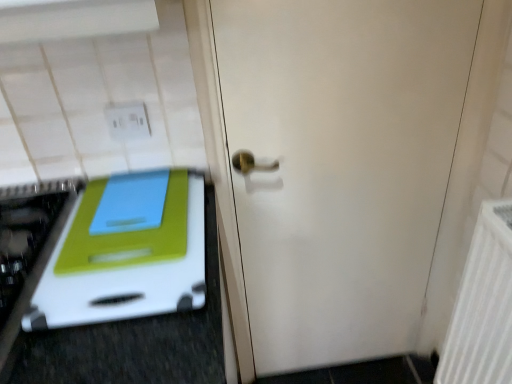
Question: From a real-world perspective, is white matte door at center physically located above or below white plastic cutting board at left?

Choices:
 (A) above
 (B) below

Answer: (B)

Question: Which is correct: white matte door at center is inside white plastic cutting board at left, or outside of it?

Choices:
 (A) outside
 (B) inside

Answer: (A)

Question: Estimate the real-world distances between objects in this image. Which object is farther from the white matte door at center?

Choices:
 (A) white plastic cutting board at left
 (B) white textured radiator at right
 (C) white plastic electric outlet at upper left

Answer: (C)

Question: Considering the real-world distances, which object is farthest from the white textured radiator at right?

Choices:
 (A) white plastic electric outlet at upper left
 (B) white matte door at center
 (C) white plastic cutting board at left

Answer: (A)